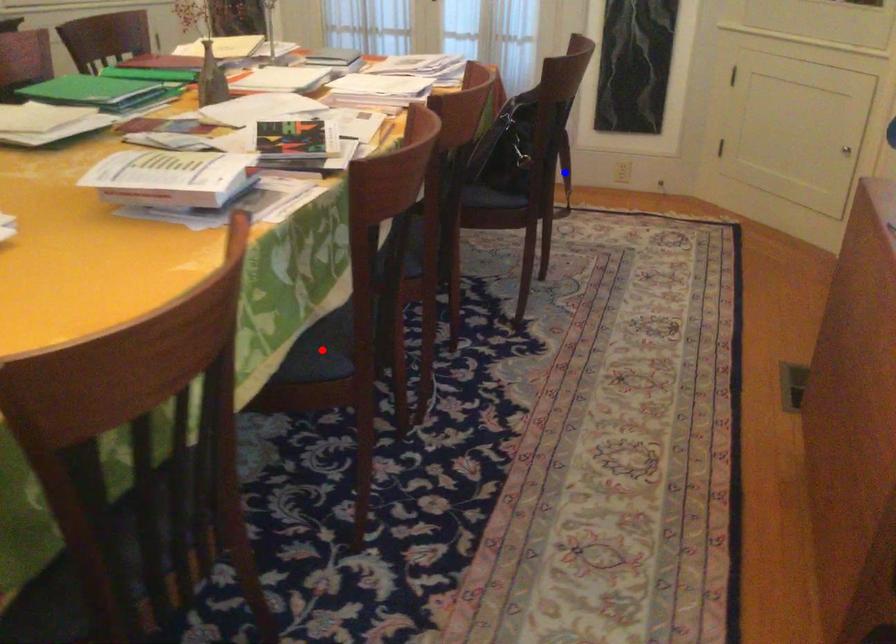
Question: Two points are marked on the image. Which point is closer to the camera?

Choices:
 (A) Blue point is closer.
 (B) Red point is closer.

Answer: (B)